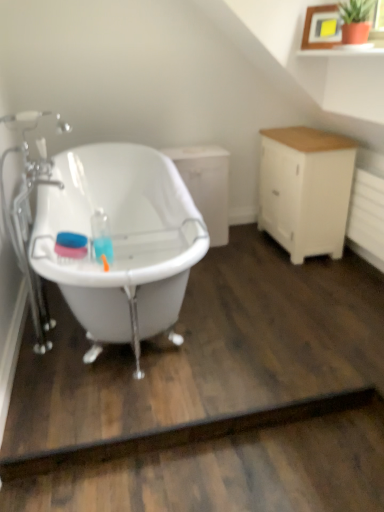
At what (x,y) coordinates should I click in order to perform the action: click on empty space that is to the right of white glossy bathtub at left. Please return your answer as a coordinate pair (x, y). The height and width of the screenshot is (512, 384). Looking at the image, I should click on (265, 292).